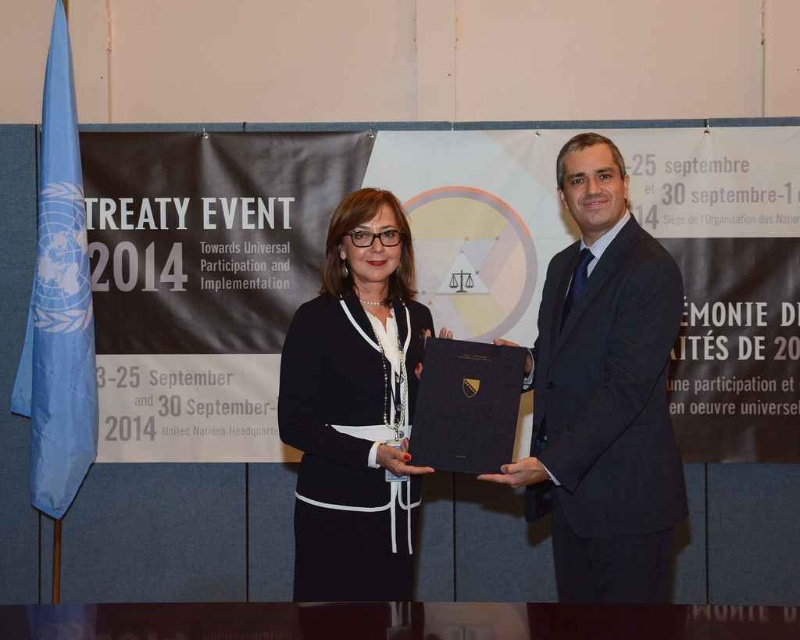
Question: Considering the relative positions of black suit at right and black matte jacket at center in the image provided, where is black suit at right located with respect to black matte jacket at center?

Choices:
 (A) left
 (B) right

Answer: (B)

Question: Considering the relative positions of black suit at right and black matte jacket at center in the image provided, where is black suit at right located with respect to black matte jacket at center?

Choices:
 (A) right
 (B) left

Answer: (A)

Question: Among these objects, which one is farthest from the camera?

Choices:
 (A) black matte jacket at center
 (B) black suit at right

Answer: (A)

Question: Considering the relative positions of black suit at right and black matte jacket at center in the image provided, where is black suit at right located with respect to black matte jacket at center?

Choices:
 (A) left
 (B) right

Answer: (B)

Question: Which point appears closest to the camera in this image?

Choices:
 (A) (544, 426)
 (B) (382, 388)

Answer: (B)